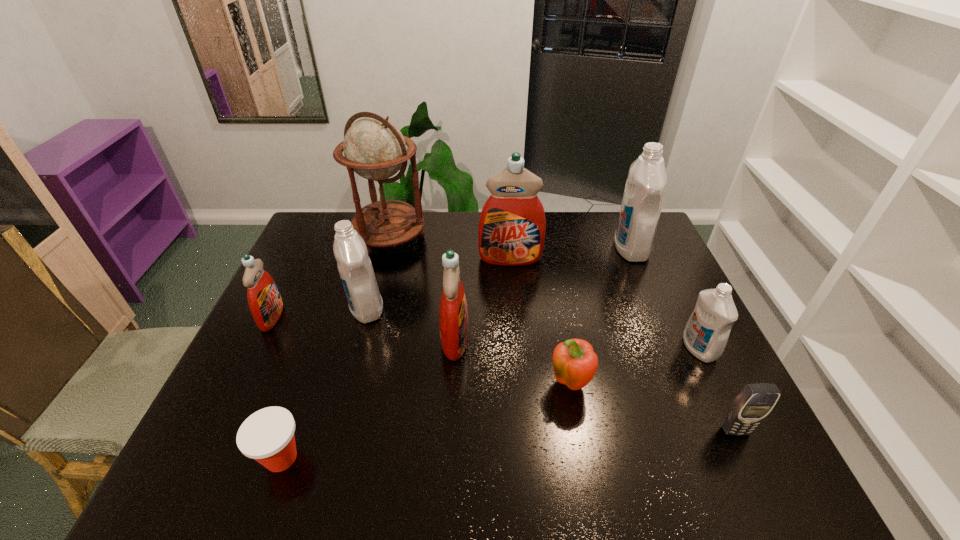
Find the location of a particular element. The width and height of the screenshot is (960, 540). vacant region that satisfies the following two spatial constraints: 1. on the front surface of the smallest red detergent; 2. on the right side of the pepper is located at coordinates (238, 386).